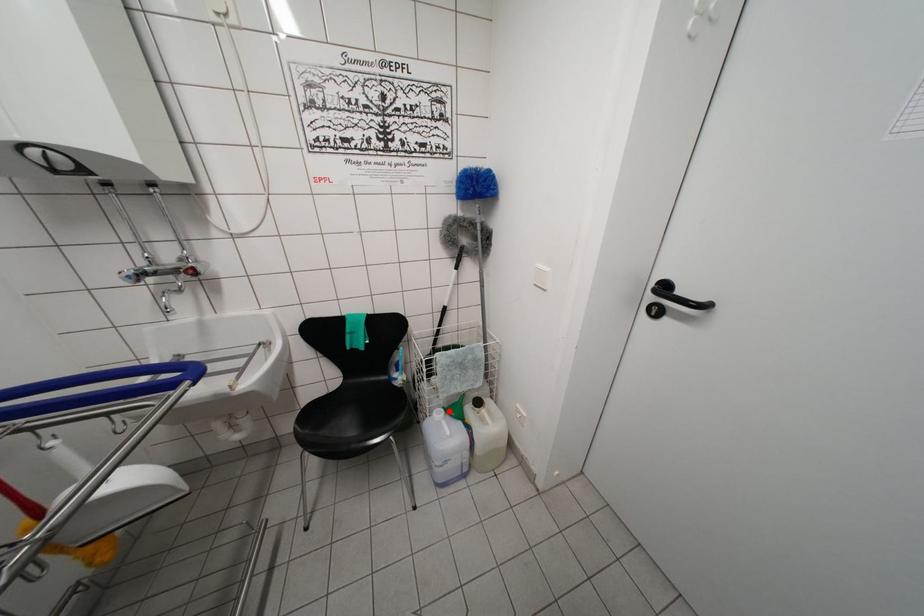
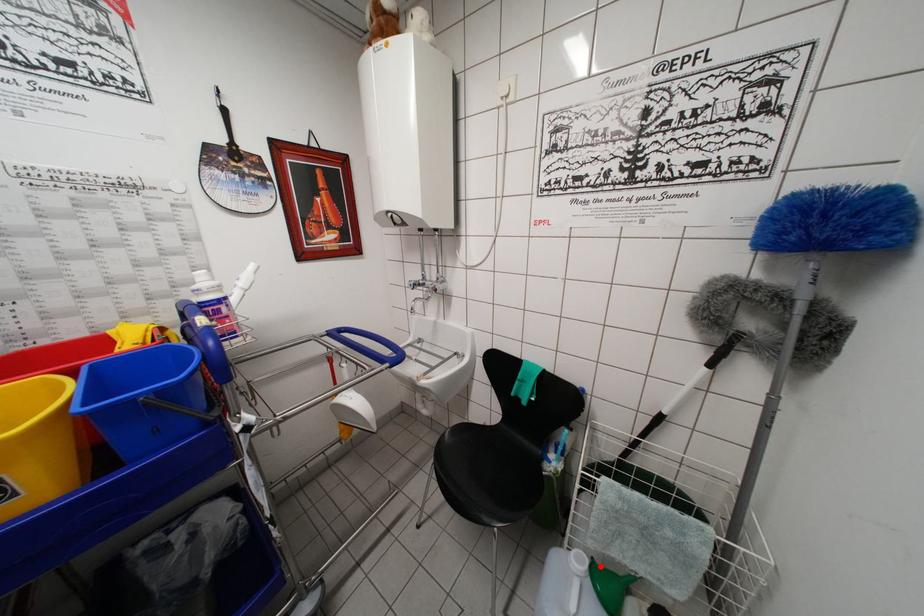
I am providing you with two images of the same scene from different viewpoints. A red point is marked on the first image and another point is marked on the second image. Do the highlighted points in image1 and image2 indicate the same real-world spot?

Yes